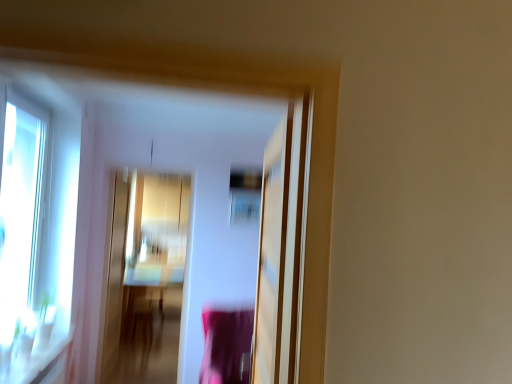
You are a GUI agent. You are given a task and a screenshot of the screen. Output one action in this format:
    pyautogui.click(x=<x>, y=<y>)
    Task: Click on the wooden table at center
    
    Given the screenshot: What is the action you would take?
    pyautogui.click(x=143, y=312)

From the image's perspective, is gold metallic screen door at center, the first screen door viewed from the back, under transparent glass screen door at center, which is counted as the 1th screen door, starting from the right?

Indeed, from the image's perspective, gold metallic screen door at center, the first screen door viewed from the back, is shown beneath transparent glass screen door at center, which is counted as the 1th screen door, starting from the right.

You are a GUI agent. You are given a task and a screenshot of the screen. Output one action in this format:
    pyautogui.click(x=<x>, y=<y>)
    Task: Click on the screen door above the gold metallic screen door at center, the first screen door viewed from the back (from the image's perspective)
    
    Given the screenshot: What is the action you would take?
    pyautogui.click(x=271, y=257)

From a real-world perspective, is gold metallic screen door at center, which is the 1th screen door in left-to-right order, positioned above or below transparent glass screen door at center, acting as the second screen door starting from the left?

gold metallic screen door at center, which is the 1th screen door in left-to-right order, is below transparent glass screen door at center, acting as the second screen door starting from the left.

Considering the relative positions of gold metallic screen door at center, which is counted as the second screen door, starting from the front, and transparent glass screen door at center, acting as the second screen door starting from the left, in the image provided, is gold metallic screen door at center, which is counted as the second screen door, starting from the front, to the right of transparent glass screen door at center, acting as the second screen door starting from the left, from the viewer's perspective?

Incorrect, gold metallic screen door at center, which is counted as the second screen door, starting from the front, is not on the right side of transparent glass screen door at center, acting as the second screen door starting from the left.

Is wooden table at center aimed at gold metallic screen door at center, the first screen door viewed from the back?

No, wooden table at center does not turn towards gold metallic screen door at center, the first screen door viewed from the back.

Is there a large distance between wooden table at center and gold metallic screen door at center, the first screen door viewed from the back?

wooden table at center is positioned a significant distance from gold metallic screen door at center, the first screen door viewed from the back.

Is wooden table at center wider or thinner than gold metallic screen door at center, which is the 1th screen door in left-to-right order?

Clearly, wooden table at center has more width compared to gold metallic screen door at center, which is the 1th screen door in left-to-right order.

Who is more distant, wooden table at center or gold metallic screen door at center, the first screen door viewed from the back?

wooden table at center is behind.

Is wooden table at center surrounded by transparent glass screen door at center, which is counted as the 1th screen door, starting from the right?

No, wooden table at center is located outside of transparent glass screen door at center, which is counted as the 1th screen door, starting from the right.

Considering the sizes of objects transparent glass screen door at center, the second screen door positioned from the back, and wooden table at center in the image provided, who is thinner, transparent glass screen door at center, the second screen door positioned from the back, or wooden table at center?

With smaller width is transparent glass screen door at center, the second screen door positioned from the back.

Is transparent glass screen door at center, which appears as the 1th screen door when viewed from the front, in front of wooden table at center?

Yes, the depth of transparent glass screen door at center, which appears as the 1th screen door when viewed from the front, is less than that of wooden table at center.

How distant is transparent glass window at left from wooden table at center?

3.46 meters.

Is wooden table at center inside transparent glass window at left?

Actually, wooden table at center is outside transparent glass window at left.

Is transparent glass window at left oriented away from wooden table at center?

No, wooden table at center is not at the back of transparent glass window at left.

From the image's perspective, which is below, wooden table at center or transparent glass window at left?

wooden table at center.

Considering the sizes of wooden table at center and transparent glass window at left in the image, is wooden table at center wider or thinner than transparent glass window at left?

wooden table at center is wider than transparent glass window at left.

Is wooden table at center located outside transparent glass window at left?

That's correct, wooden table at center is outside of transparent glass window at left.

Does wooden table at center touch transparent glass window at left?

There is a gap between wooden table at center and transparent glass window at left.

Between point (20, 303) and point (102, 356), which one is positioned behind?

Point (102, 356)

From the image's perspective, is transparent glass window at left positioned above or below gold metallic screen door at center, the second screen door positioned from the right?

transparent glass window at left is situated higher than gold metallic screen door at center, the second screen door positioned from the right, in the image.

From a real-world perspective, relative to gold metallic screen door at center, the first screen door viewed from the back, is transparent glass window at left vertically above or below?

transparent glass window at left is situated higher than gold metallic screen door at center, the first screen door viewed from the back, in the real world.

From their relative heights in the image, would you say transparent glass screen door at center, acting as the second screen door starting from the left, is taller or shorter than gold metallic screen door at center, which is the 1th screen door in left-to-right order?

Clearly, transparent glass screen door at center, acting as the second screen door starting from the left, is shorter compared to gold metallic screen door at center, which is the 1th screen door in left-to-right order.

Looking at this image, is transparent glass screen door at center, the second screen door positioned from the back, aimed at gold metallic screen door at center, which is counted as the second screen door, starting from the front?

No, transparent glass screen door at center, the second screen door positioned from the back, is not turned towards gold metallic screen door at center, which is counted as the second screen door, starting from the front.

From the image's perspective, is transparent glass screen door at center, the second screen door positioned from the back, below gold metallic screen door at center, which is counted as the second screen door, starting from the front?

Actually, transparent glass screen door at center, the second screen door positioned from the back, appears above gold metallic screen door at center, which is counted as the second screen door, starting from the front, in the image.

How much distance is there between transparent glass screen door at center, the second screen door positioned from the back, and gold metallic screen door at center, which is the 1th screen door in left-to-right order?

transparent glass screen door at center, the second screen door positioned from the back, is 2.80 meters from gold metallic screen door at center, which is the 1th screen door in left-to-right order.

Locate an element on the screen. The image size is (512, 384). screen door that appears on the right of gold metallic screen door at center, the first screen door viewed from the back is located at coordinates (271, 257).

In order to click on table below the gold metallic screen door at center, the first screen door viewed from the back (from the image's perspective) in this screenshot , I will do `click(143, 312)`.

Based on their spatial positions, is transparent glass screen door at center, which is counted as the 1th screen door, starting from the right, or wooden table at center closer to transparent glass window at left?

transparent glass screen door at center, which is counted as the 1th screen door, starting from the right, lies closer to transparent glass window at left than the other object.

Consider the image. Which object lies further to the anchor point transparent glass screen door at center, the second screen door positioned from the back, gold metallic screen door at center, the second screen door positioned from the right, or wooden table at center?

The object further to transparent glass screen door at center, the second screen door positioned from the back, is wooden table at center.

Which object lies further to the anchor point transparent glass screen door at center, acting as the second screen door starting from the left, transparent glass window at left or wooden table at center?

wooden table at center is further to transparent glass screen door at center, acting as the second screen door starting from the left.

From the image, which object appears to be nearer to gold metallic screen door at center, the first screen door viewed from the back, transparent glass window at left or wooden table at center?

Among the two, transparent glass window at left is located nearer to gold metallic screen door at center, the first screen door viewed from the back.

Which object lies further to the anchor point gold metallic screen door at center, the first screen door viewed from the back, transparent glass window at left or transparent glass screen door at center, acting as the second screen door starting from the left?

transparent glass screen door at center, acting as the second screen door starting from the left, is positioned further to the anchor gold metallic screen door at center, the first screen door viewed from the back.

Which object lies further to the anchor point wooden table at center, transparent glass window at left or transparent glass screen door at center, which appears as the 1th screen door when viewed from the front?

transparent glass screen door at center, which appears as the 1th screen door when viewed from the front, is positioned further to the anchor wooden table at center.

Estimate the real-world distances between objects in this image. Which object is closer to wooden table at center, transparent glass window at left or gold metallic screen door at center, the first screen door viewed from the back?

gold metallic screen door at center, the first screen door viewed from the back, lies closer to wooden table at center than the other object.

Considering their positions, is wooden table at center positioned further to transparent glass window at left than gold metallic screen door at center, the second screen door positioned from the right?

Among the two, wooden table at center is located further to transparent glass window at left.

Where is `window positioned between transparent glass screen door at center, the second screen door positioned from the back, and gold metallic screen door at center, the first screen door viewed from the back, from near to far`? This screenshot has width=512, height=384. window positioned between transparent glass screen door at center, the second screen door positioned from the back, and gold metallic screen door at center, the first screen door viewed from the back, from near to far is located at coordinates (20, 220).

Image resolution: width=512 pixels, height=384 pixels. Find the location of `screen door positioned between transparent glass screen door at center, which appears as the 1th screen door when viewed from the front, and wooden table at center from near to far`. screen door positioned between transparent glass screen door at center, which appears as the 1th screen door when viewed from the front, and wooden table at center from near to far is located at coordinates (114, 279).

Identify the location of window located between transparent glass screen door at center, which is counted as the 1th screen door, starting from the right, and wooden table at center in the depth direction. The height and width of the screenshot is (384, 512). (20, 220).

In order to click on screen door located between transparent glass window at left and wooden table at center in the depth direction in this screenshot , I will do `click(114, 279)`.